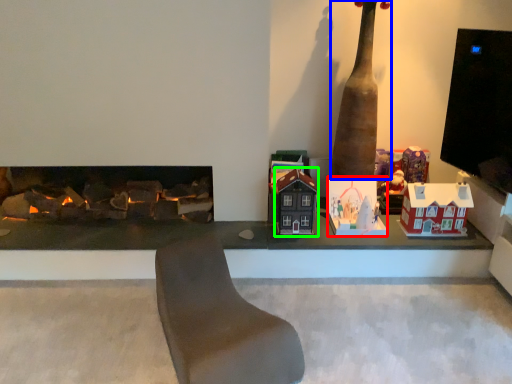
Question: Considering the real-world distances, which object is closest to toy (highlighted by a red box)? totem pole (highlighted by a blue box) or toy (highlighted by a green box).

Choices:
 (A) totem pole
 (B) toy

Answer: (B)